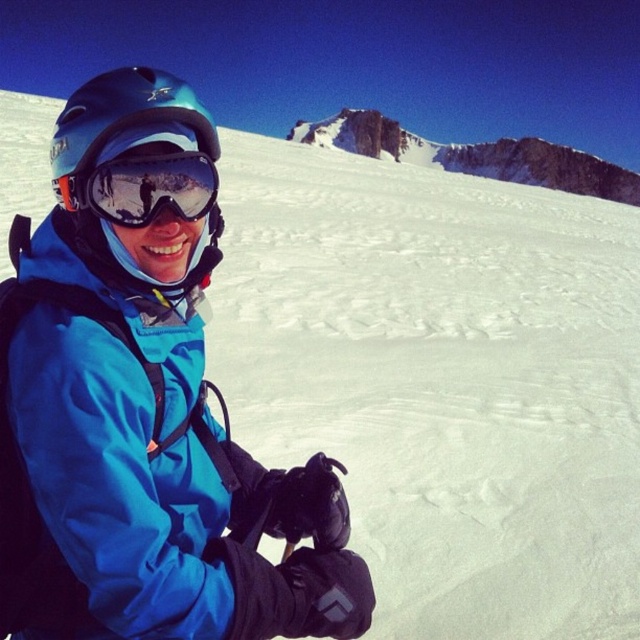
Question: Does rugged stone mountain at upper center appear on the left side of glossy reflective goggles at center?

Choices:
 (A) no
 (B) yes

Answer: (A)

Question: Which of the following is the farthest from the observer?

Choices:
 (A) matte blue helmet at left
 (B) glossy reflective goggles at center

Answer: (B)

Question: Does rugged stone mountain at upper center lie in front of matte blue helmet at left?

Choices:
 (A) no
 (B) yes

Answer: (A)

Question: Among these objects, which one is nearest to the camera?

Choices:
 (A) rugged stone mountain at upper center
 (B) glossy reflective goggles at center
 (C) matte blue helmet at left

Answer: (C)

Question: Which object appears farthest from the camera in this image?

Choices:
 (A) matte blue helmet at left
 (B) glossy reflective goggles at center
 (C) rugged stone mountain at upper center

Answer: (C)

Question: Does rugged stone mountain at upper center appear on the left side of glossy reflective goggles at center?

Choices:
 (A) no
 (B) yes

Answer: (A)